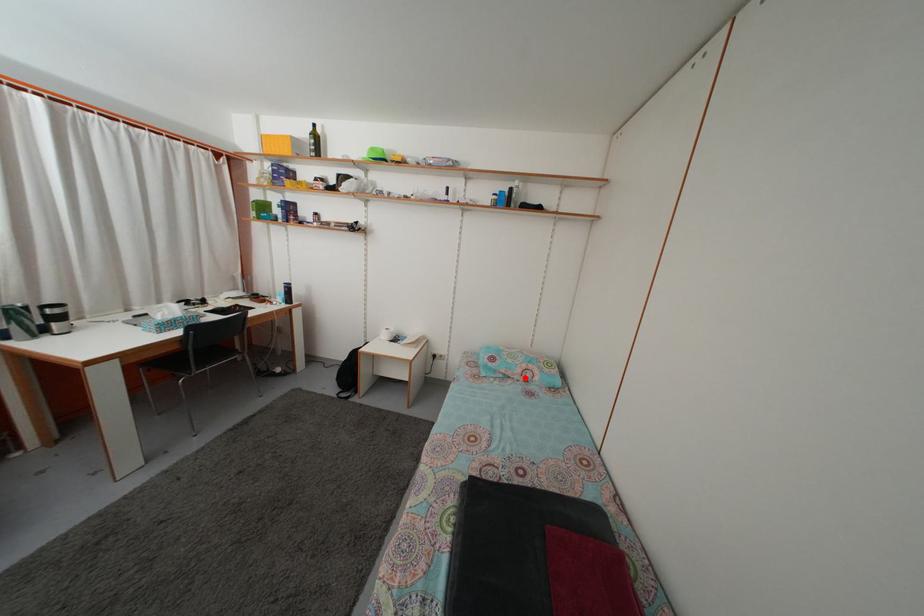
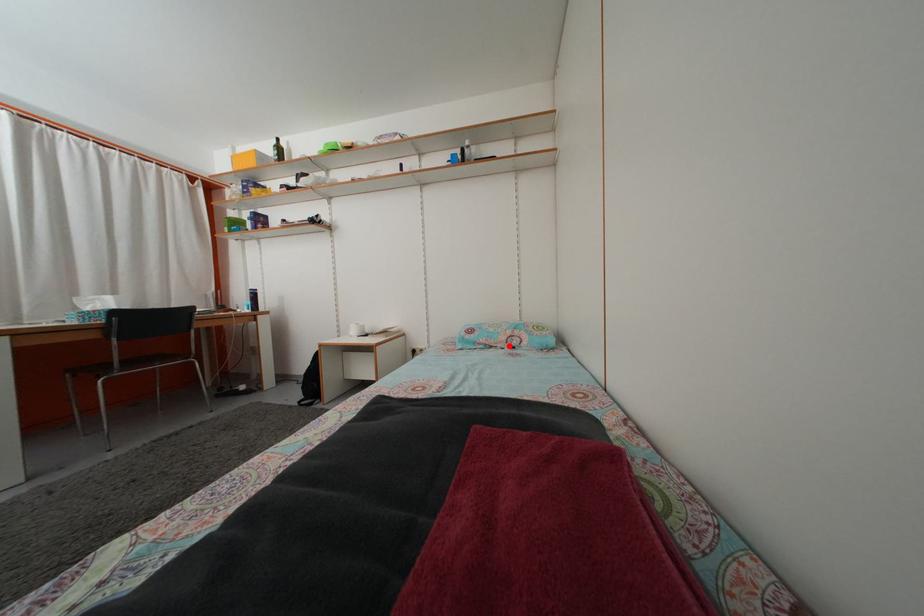
I am providing you with two images of the same scene from different viewpoints. A red point is marked on the first image and another point is marked on the second image. Is the red point in image1 aligned with the point shown in image2?

Yes